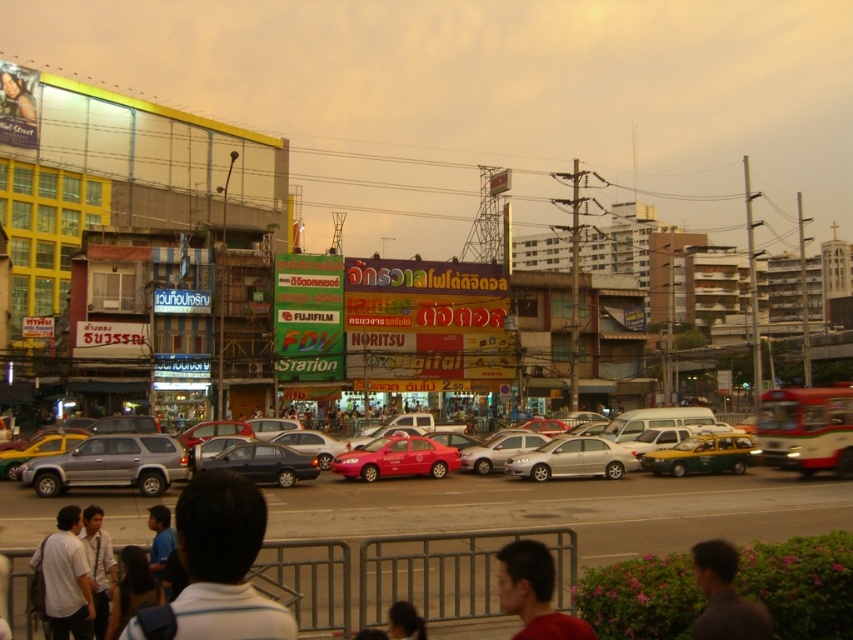
You are a delivery person needing to load a tall package onto a vehicle. You see two suvs in the image, the silver metallic suv at center and the matte silver suv at center. Which suv has a taller height and can accommodate the tall package?

The matte silver suv at center has a greater height compared to the silver metallic suv at center, so it can accommodate the tall package.

You are a pedestrian waiting at the crosswalk. You see the silver metallic suv at center and the matte red taxi at center. Which vehicle is closer to you?

The matte red taxi at center is closer to you because the silver metallic suv at center is above it, indicating it is further away.

You are a pedestrian standing on the sidewalk looking towards the street. You see a white fabric shirt at lower center and a silver metallic suv at center. Which object is closer to you?

The white fabric shirt at lower center is closer to you because it is in front of the silver metallic suv at center.